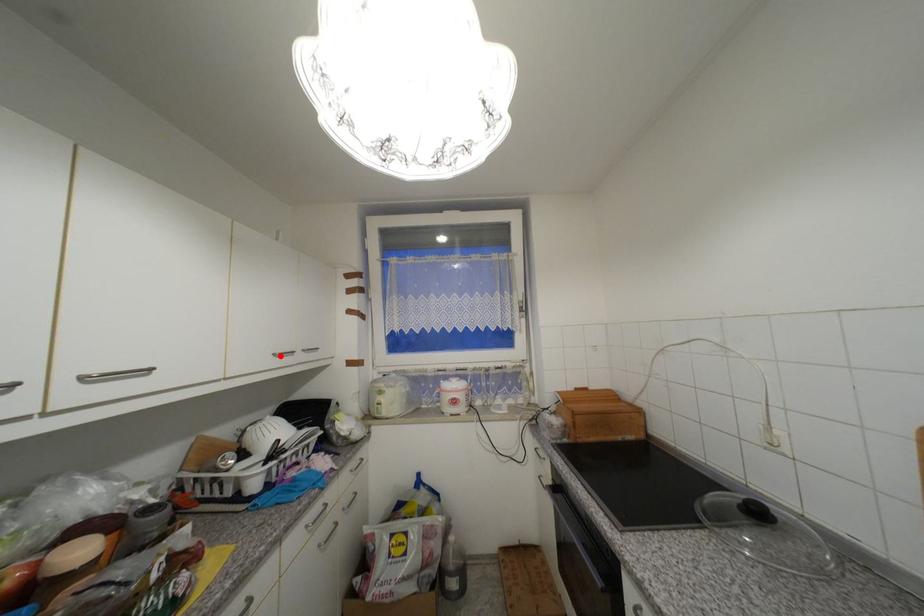
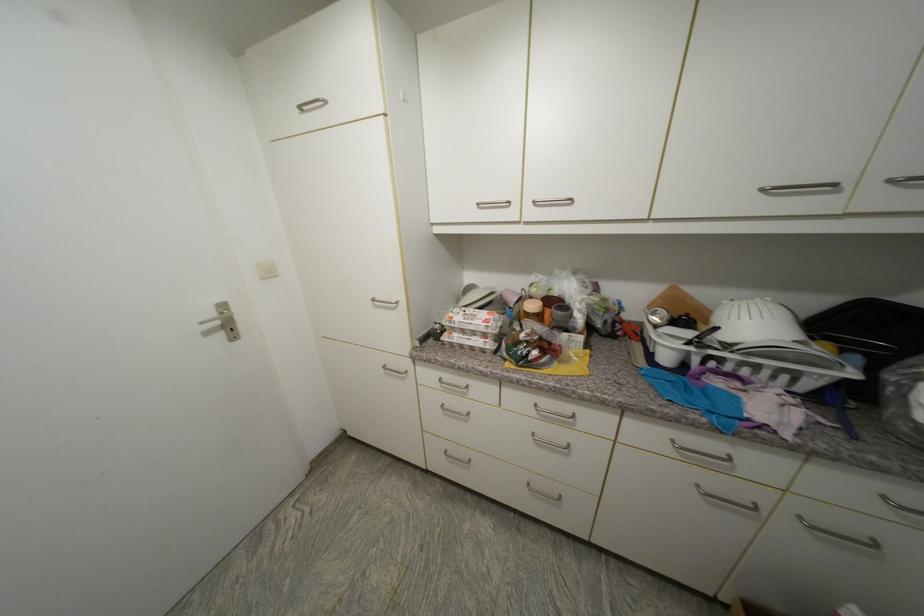
Locate, in the second image, the point that corresponds to the highlighted location in the first image.

(768, 191)